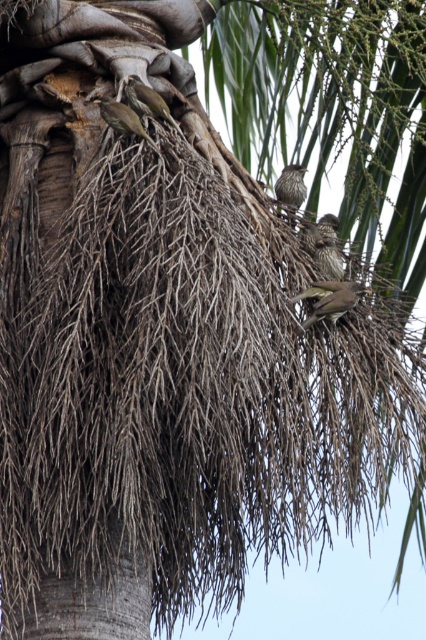
Looking at this image, you are a birdwatcher observing a palm tree with two clusters of brown speckled feathers. Which cluster, the brown speckled feathers at upper right or the brown speckled feathers at upper left, is positioned more to the east if the palm tree is facing north?

The brown speckled feathers at upper right is positioned more to the east since it is to the right of the brown speckled feathers at upper left, and the tree faces north, making right correspond to east.